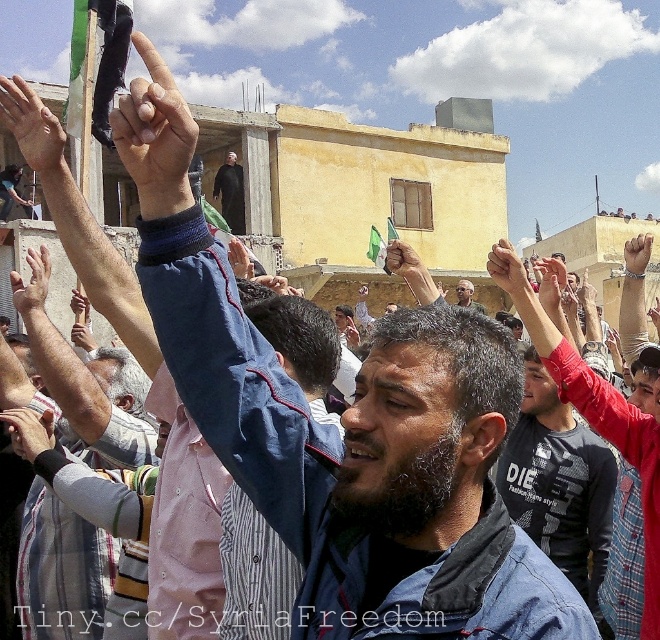
Looking at this image, you are a photographer trying to capture a photo that includes both the matte black hand at upper center and the matte black flag at upper left. Given that your camera has a maximum focus range of 6 meters, will you be able to get both objects in focus at the same time?

The matte black hand at upper center and matte black flag at upper left are 6.30 meters apart. Since the distance between them exceeds the camera maximum focus range of 6 meters, you cannot get both objects in focus at the same time.